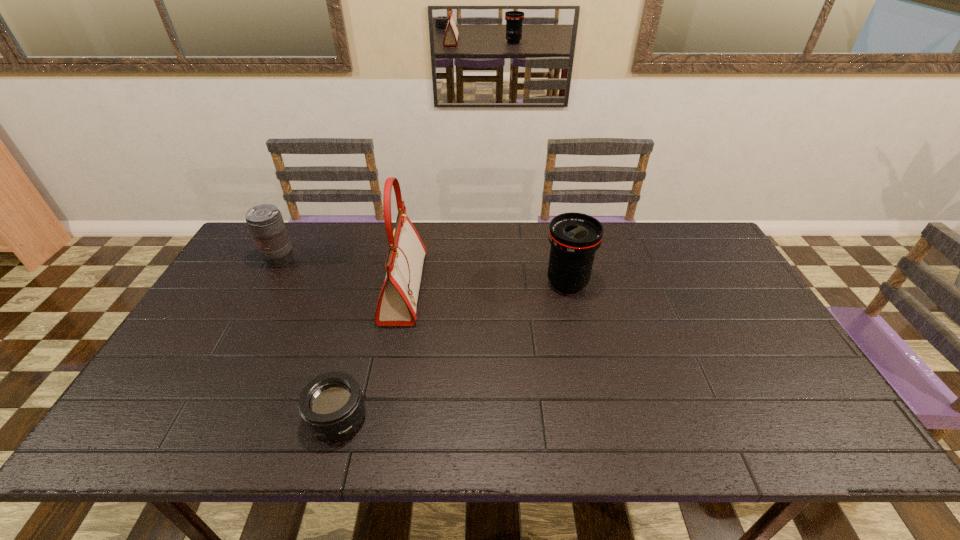
At what (x,y) coordinates should I click in order to perform the action: click on free space between the handbag and the leftmost object. Please return your answer as a coordinate pair (x, y). The height and width of the screenshot is (540, 960). Looking at the image, I should click on (342, 274).

Locate an element on the screen. empty space that is in between the nearest object and the tallest object is located at coordinates (371, 353).

Where is `free space that is in between the nearest object and the rightmost telephoto lens`? This screenshot has height=540, width=960. free space that is in between the nearest object and the rightmost telephoto lens is located at coordinates (452, 350).

This screenshot has height=540, width=960. In order to click on free space between the handbag and the rightmost object in this screenshot , I will do `click(486, 286)`.

Locate an element on the screen. The width and height of the screenshot is (960, 540). vacant region between the nearest object and the handbag is located at coordinates (371, 353).

Find the location of a particular element. The width and height of the screenshot is (960, 540). empty space between the second telephoto lens from right to left and the rightmost object is located at coordinates (452, 350).

This screenshot has height=540, width=960. Find the location of `unoccupied area between the shortest telephoto lens and the tallest object`. unoccupied area between the shortest telephoto lens and the tallest object is located at coordinates (371, 353).

This screenshot has width=960, height=540. Find the location of `vacant area that lies between the leftmost object and the tallest object`. vacant area that lies between the leftmost object and the tallest object is located at coordinates (342, 274).

Identify the location of empty space between the handbag and the leftmost telephoto lens. [x=342, y=274].

Point out which object is positioned as the nearest to the second telephoto lens from left to right. Please provide its 2D coordinates. Your answer should be formatted as a tuple, i.e. [(x, y)], where the tuple contains the x and y coordinates of a point satisfying the conditions above.

[(396, 307)]